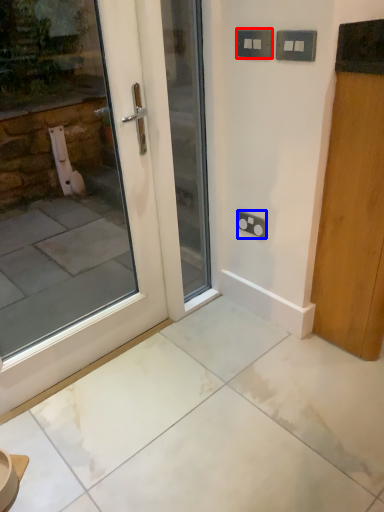
Question: Among these objects, which one is nearest to the camera, electric outlet (highlighted by a red box) or electric outlet (highlighted by a blue box)?

Choices:
 (A) electric outlet
 (B) electric outlet

Answer: (A)